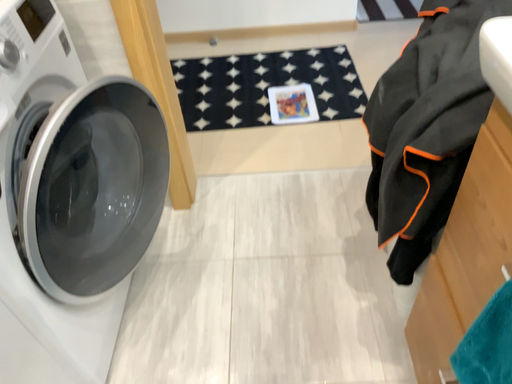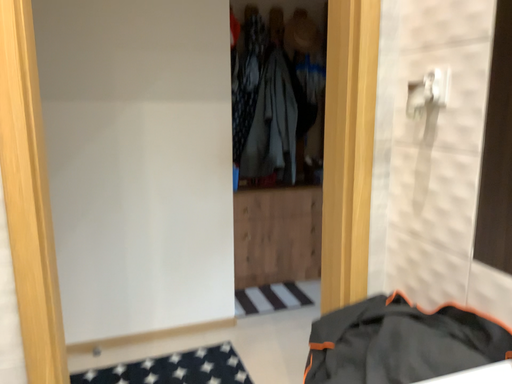
Question: Which way did the camera rotate in the video?

Choices:
 (A) rotated left
 (B) rotated right

Answer: (B)